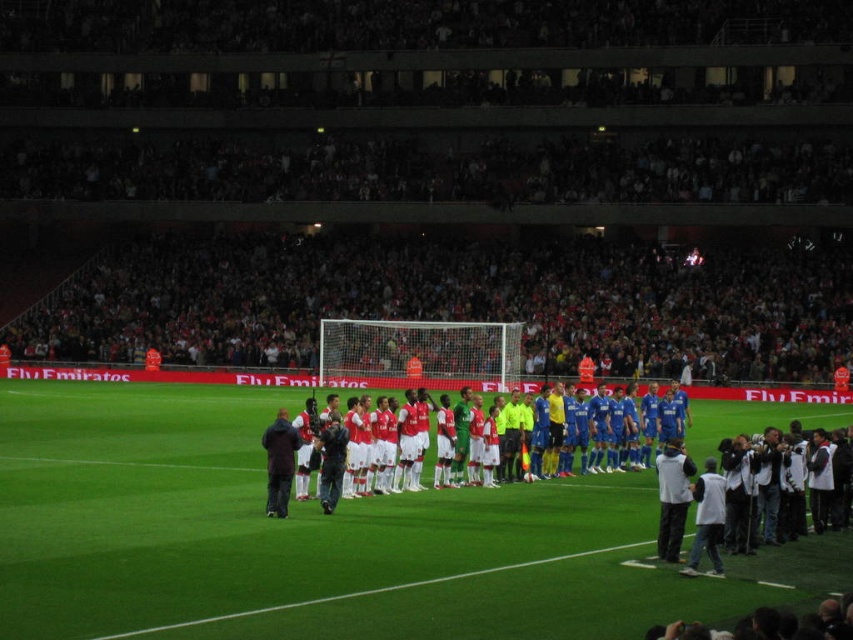
You are a photographer positioned at the edge of the field. You want to take a photo of the dark blue jacket at center without the white smooth soccer team at center blocking it. What should you do?

The dark blue jacket at center is behind the white smooth soccer team at center, so you should move to a position where you can see behind the white smooth soccer team at center to capture the dark blue jacket at center without obstruction.

You are a photographer standing at the edge of the field. You want to take a photo that includes both the green artificial turf at center and the dark blue jacket at center. What is the minimum distance you need to move backward from your current position to ensure both are in frame?

The green artificial turf at center and dark blue jacket at center are 24.18 feet apart. To include both in the frame, you need to move backward until you can capture a distance of at least 24.18 feet between them, which would require positioning yourself far enough back to encompass that span within your camera lens.